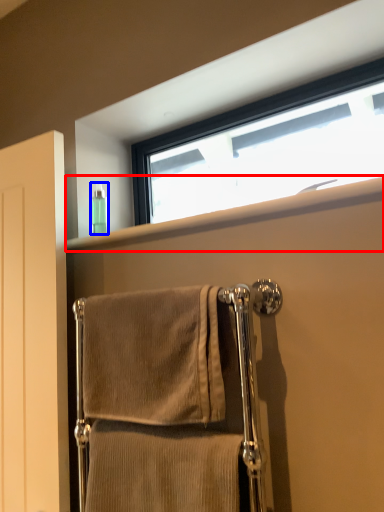
Question: Which of the following is the farthest to the observer, window sill (highlighted by a red box) or toiletry (highlighted by a blue box)?

Choices:
 (A) window sill
 (B) toiletry

Answer: (B)